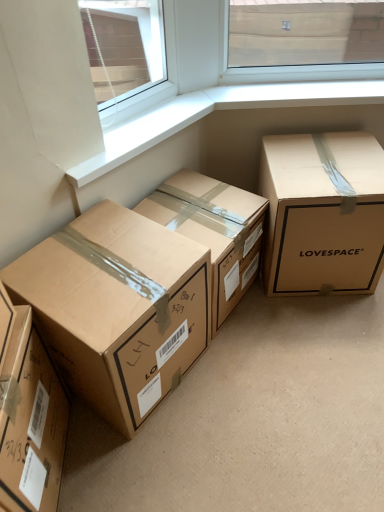
This screenshot has width=384, height=512. What do you see at coordinates (214, 231) in the screenshot? I see `brown cardboard box at center, which is counted as the third box, starting from the left` at bounding box center [214, 231].

Locate an element on the screen. brown cardboard box at lower left, the first box viewed from the left is located at coordinates (31, 422).

Locate an element on the screen. This screenshot has width=384, height=512. brown cardboard box at lower left, the 3th box viewed from the right is located at coordinates (117, 308).

At what (x,y) coordinates should I click in order to perform the action: click on matte cardboard box at right, which is counted as the 1th box, starting from the right. Please return your answer as a coordinate pair (x, y). Looking at the image, I should click on (323, 213).

I want to click on brown cardboard box at center, which appears as the 2th box when viewed from the right, so click(214, 231).

From the picture: Considering the relative sizes of matte cardboard box at right, the fourth box in the left-to-right sequence, and brown cardboard box at lower left, the first box viewed from the left, in the image provided, is matte cardboard box at right, the fourth box in the left-to-right sequence, bigger than brown cardboard box at lower left, the first box viewed from the left,?

Indeed, matte cardboard box at right, the fourth box in the left-to-right sequence, has a larger size compared to brown cardboard box at lower left, the first box viewed from the left.

How many degrees apart are the facing directions of matte cardboard box at right, which is counted as the 1th box, starting from the right, and brown cardboard box at lower left, the first box viewed from the left?

92.1 degrees separate the facing orientations of matte cardboard box at right, which is counted as the 1th box, starting from the right, and brown cardboard box at lower left, the first box viewed from the left.

Considering the sizes of objects matte cardboard box at right, the fourth box in the left-to-right sequence, and brown cardboard box at lower left, the fourth box viewed from the right, in the image provided, who is wider, matte cardboard box at right, the fourth box in the left-to-right sequence, or brown cardboard box at lower left, the fourth box viewed from the right,?

Wider between the two is matte cardboard box at right, the fourth box in the left-to-right sequence.

Does matte cardboard box at right, the fourth box in the left-to-right sequence, turn towards brown cardboard box at lower left, the first box viewed from the left?

No.

Which object is thinner, brown cardboard box at center, which appears as the 2th box when viewed from the right, or matte cardboard box at right, which is counted as the 1th box, starting from the right?

With smaller width is brown cardboard box at center, which appears as the 2th box when viewed from the right.

Is point (205, 182) in front of point (322, 287)?

Yes.

Considering the relative sizes of brown cardboard box at center, which appears as the 2th box when viewed from the right, and matte cardboard box at right, the fourth box in the left-to-right sequence, in the image provided, is brown cardboard box at center, which appears as the 2th box when viewed from the right, shorter than matte cardboard box at right, the fourth box in the left-to-right sequence,?

Yes.

Is matte cardboard box at right, the fourth box in the left-to-right sequence, at the back of brown cardboard box at center, which appears as the 2th box when viewed from the right?

No, brown cardboard box at center, which appears as the 2th box when viewed from the right, is not facing away from matte cardboard box at right, the fourth box in the left-to-right sequence.

Is brown cardboard box at center, which appears as the 2th box when viewed from the right, to the right of brown cardboard box at lower left, the fourth box viewed from the right, from the viewer's perspective?

Yes, brown cardboard box at center, which appears as the 2th box when viewed from the right, is to the right of brown cardboard box at lower left, the fourth box viewed from the right.

Is brown cardboard box at center, which is counted as the third box, starting from the left, oriented away from brown cardboard box at lower left, the first box viewed from the left?

No, brown cardboard box at lower left, the first box viewed from the left, is not at the back of brown cardboard box at center, which is counted as the third box, starting from the left.

Considering the relative sizes of brown cardboard box at center, which is counted as the third box, starting from the left, and brown cardboard box at lower left, the first box viewed from the left, in the image provided, is brown cardboard box at center, which is counted as the third box, starting from the left, taller than brown cardboard box at lower left, the first box viewed from the left,?

Incorrect, the height of brown cardboard box at center, which is counted as the third box, starting from the left, is not larger of that of brown cardboard box at lower left, the first box viewed from the left.

How many degrees apart are the facing directions of brown cardboard box at center, which is counted as the third box, starting from the left, and brown cardboard box at lower left, the first box viewed from the left?

brown cardboard box at center, which is counted as the third box, starting from the left, and brown cardboard box at lower left, the first box viewed from the left, are facing 38.2 degrees away from each other.

Considering the points (136, 130) and (191, 218), which point is behind, point (136, 130) or point (191, 218)?

The point (191, 218) is more distant.

Is white smooth window sill at upper center wider or thinner than brown cardboard box at center, which is counted as the third box, starting from the left?

Clearly, white smooth window sill at upper center has less width compared to brown cardboard box at center, which is counted as the third box, starting from the left.

Is white smooth window sill at upper center positioned behind brown cardboard box at center, which appears as the 2th box when viewed from the right?

No, it is not.

Considering the relative positions of white smooth window sill at upper center and brown cardboard box at center, which appears as the 2th box when viewed from the right, in the image provided, is white smooth window sill at upper center to the left of brown cardboard box at center, which appears as the 2th box when viewed from the right, from the viewer's perspective?

Yes.

Considering the positions of objects brown cardboard box at lower left, the fourth box viewed from the right, and white smooth window sill at upper center in the image provided, who is more to the left, brown cardboard box at lower left, the fourth box viewed from the right, or white smooth window sill at upper center?

brown cardboard box at lower left, the fourth box viewed from the right, is more to the left.

How far apart are brown cardboard box at lower left, the fourth box viewed from the right, and white smooth window sill at upper center?

brown cardboard box at lower left, the fourth box viewed from the right, and white smooth window sill at upper center are 29.03 inches apart from each other.

From the picture: From the image's perspective, relative to white smooth window sill at upper center, is brown cardboard box at lower left, the first box viewed from the left, above or below?

From the image's perspective, brown cardboard box at lower left, the first box viewed from the left, appears below white smooth window sill at upper center.

How many degrees apart are the facing directions of brown cardboard box at lower left, the fourth box viewed from the right, and white smooth window sill at upper center?

They differ by 44.2 degrees in their facing directions.

Which box is the 1st one when counting from the right side of the brown cardboard box at lower left, the 3th box viewed from the right? Please provide its 2D coordinates.

[(214, 231)]

Is point (128, 349) closer or farther from the camera than point (211, 332)?

Point (128, 349) appears to be closer to the viewer than point (211, 332).

Could you measure the distance between brown cardboard box at lower left, the 3th box viewed from the right, and brown cardboard box at center, which appears as the 2th box when viewed from the right?

brown cardboard box at lower left, the 3th box viewed from the right, is 11.47 inches away from brown cardboard box at center, which appears as the 2th box when viewed from the right.

Which of these two, brown cardboard box at lower left, the 3th box viewed from the right, or brown cardboard box at center, which appears as the 2th box when viewed from the right, is bigger?

With larger size is brown cardboard box at lower left, the 3th box viewed from the right.

From the picture: Considering the relative sizes of white smooth window sill at upper center and brown cardboard box at lower left, which ranks as the second box in left-to-right order, in the image provided, is white smooth window sill at upper center thinner than brown cardboard box at lower left, which ranks as the second box in left-to-right order,?

Yes.

Does white smooth window sill at upper center touch brown cardboard box at lower left, which ranks as the second box in left-to-right order?

No.

Considering the points (155, 108) and (83, 356), which point is in front, point (155, 108) or point (83, 356)?

The point (83, 356) is closer.

Is white smooth window sill at upper center oriented away from brown cardboard box at lower left, the 3th box viewed from the right?

No.

Find the location of a particular element. The image size is (384, 512). the 3rd box behind the brown cardboard box at lower left, the fourth box viewed from the right is located at coordinates (323, 213).

Locate an element on the screen. The width and height of the screenshot is (384, 512). box that is the 1st object located below the matte cardboard box at right, which is counted as the 1th box, starting from the right (from the image's perspective) is located at coordinates (214, 231).

When comparing their distances from white smooth window sill at upper center, does brown cardboard box at lower left, the first box viewed from the left, or brown cardboard box at lower left, the 3th box viewed from the right, seem closer?

brown cardboard box at lower left, the 3th box viewed from the right.

Looking at the image, which one is located closer to brown cardboard box at center, which appears as the 2th box when viewed from the right, brown cardboard box at lower left, the 3th box viewed from the right, or brown cardboard box at lower left, the first box viewed from the left?

brown cardboard box at lower left, the 3th box viewed from the right, is closer to brown cardboard box at center, which appears as the 2th box when viewed from the right.

When comparing their distances from matte cardboard box at right, the fourth box in the left-to-right sequence, does brown cardboard box at center, which appears as the 2th box when viewed from the right, or brown cardboard box at lower left, the fourth box viewed from the right, seem further?

brown cardboard box at lower left, the fourth box viewed from the right.

When comparing their distances from brown cardboard box at lower left, the 3th box viewed from the right, does brown cardboard box at lower left, the first box viewed from the left, or white smooth window sill at upper center seem further?

white smooth window sill at upper center lies further to brown cardboard box at lower left, the 3th box viewed from the right, than the other object.

Consider the image. Estimate the real-world distances between objects in this image. Which object is closer to brown cardboard box at lower left, the first box viewed from the left, brown cardboard box at center, which appears as the 2th box when viewed from the right, or white smooth window sill at upper center?

brown cardboard box at center, which appears as the 2th box when viewed from the right.

When comparing their distances from matte cardboard box at right, which is counted as the 1th box, starting from the right, does brown cardboard box at lower left, the first box viewed from the left, or brown cardboard box at lower left, the 3th box viewed from the right, seem further?

Based on the image, brown cardboard box at lower left, the first box viewed from the left, appears to be further to matte cardboard box at right, which is counted as the 1th box, starting from the right.

Which object lies nearer to the anchor point brown cardboard box at lower left, the fourth box viewed from the right, brown cardboard box at lower left, which ranks as the second box in left-to-right order, or white smooth window sill at upper center?

The object closer to brown cardboard box at lower left, the fourth box viewed from the right, is brown cardboard box at lower left, which ranks as the second box in left-to-right order.

When comparing their distances from matte cardboard box at right, which is counted as the 1th box, starting from the right, does white smooth window sill at upper center or brown cardboard box at lower left, the 3th box viewed from the right, seem further?

brown cardboard box at lower left, the 3th box viewed from the right, is positioned further to the anchor matte cardboard box at right, which is counted as the 1th box, starting from the right.

Identify the location of box between brown cardboard box at lower left, the first box viewed from the left, and brown cardboard box at center, which is counted as the third box, starting from the left, in the horizontal direction. The width and height of the screenshot is (384, 512). (117, 308).

You are a GUI agent. You are given a task and a screenshot of the screen. Output one action in this format:
    pyautogui.click(x=<x>, y=<y>)
    Task: Click on the box between brown cardboard box at lower left, the 3th box viewed from the right, and matte cardboard box at right, the fourth box in the left-to-right sequence, in the horizontal direction
    The image size is (384, 512).
    Given the screenshot: What is the action you would take?
    pyautogui.click(x=214, y=231)

This screenshot has height=512, width=384. Find the location of `window sill located between brown cardboard box at lower left, the fourth box viewed from the right, and matte cardboard box at right, the fourth box in the left-to-right sequence, in the left-right direction`. window sill located between brown cardboard box at lower left, the fourth box viewed from the right, and matte cardboard box at right, the fourth box in the left-to-right sequence, in the left-right direction is located at coordinates (142, 134).

The height and width of the screenshot is (512, 384). Identify the location of box located between white smooth window sill at upper center and matte cardboard box at right, which is counted as the 1th box, starting from the right, in the left-right direction. (214, 231).